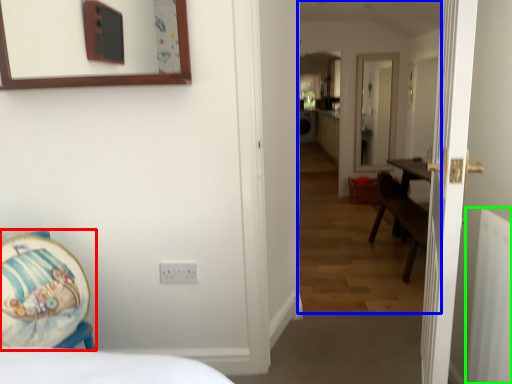
Question: Which object is the closest to the armchair (highlighted by a red box)? Choose among these: corridor (highlighted by a blue box) or radiator (highlighted by a green box).

Choices:
 (A) corridor
 (B) radiator

Answer: (B)